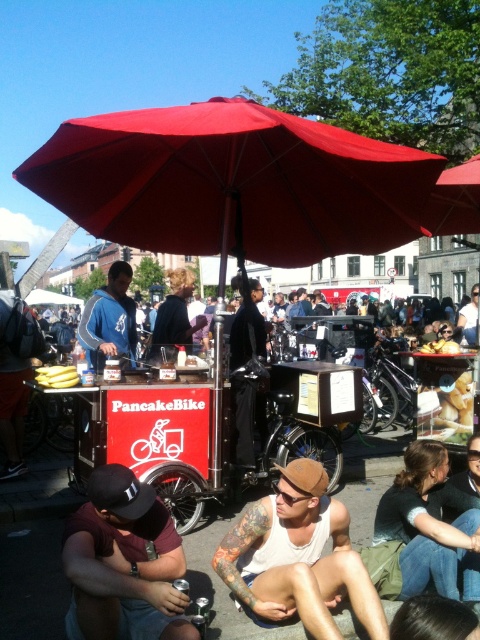
Does maroon fabric shirt at lower left appear over blue fleece jacket at center?

Actually, maroon fabric shirt at lower left is below blue fleece jacket at center.

Image resolution: width=480 pixels, height=640 pixels. What do you see at coordinates (123, 563) in the screenshot?
I see `maroon fabric shirt at lower left` at bounding box center [123, 563].

The height and width of the screenshot is (640, 480). I want to click on maroon fabric shirt at lower left, so click(123, 563).

The image size is (480, 640). What are the coordinates of `red fabric umbrella at center` in the screenshot? It's located at (232, 182).

Does red fabric umbrella at center have a lesser width compared to yellow matte bananas at lower left?

In fact, red fabric umbrella at center might be wider than yellow matte bananas at lower left.

At what (x,y) coordinates should I click in order to perform the action: click on red fabric umbrella at center. Please return your answer as a coordinate pair (x, y). Looking at the image, I should click on (232, 182).

Between point (178, 291) and point (68, 376), which one is positioned in front?

Positioned in front is point (68, 376).

Does point (188, 280) lie behind point (43, 369)?

Yes.

Is point (155, 356) positioned behind point (38, 378)?

Yes, point (155, 356) is behind point (38, 378).

At what (x,y) coordinates should I click in order to perform the action: click on dark brown leather jacket at center. Please return your answer as a coordinate pair (x, y). Looking at the image, I should click on (175, 316).